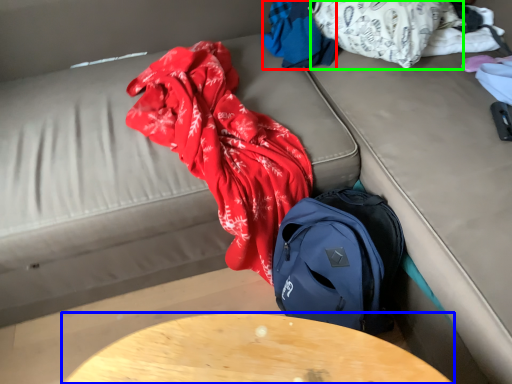
Question: Which object is positioned farthest from clothing (highlighted by a red box)? Select from table (highlighted by a blue box) and clothing (highlighted by a green box).

Choices:
 (A) table
 (B) clothing

Answer: (A)